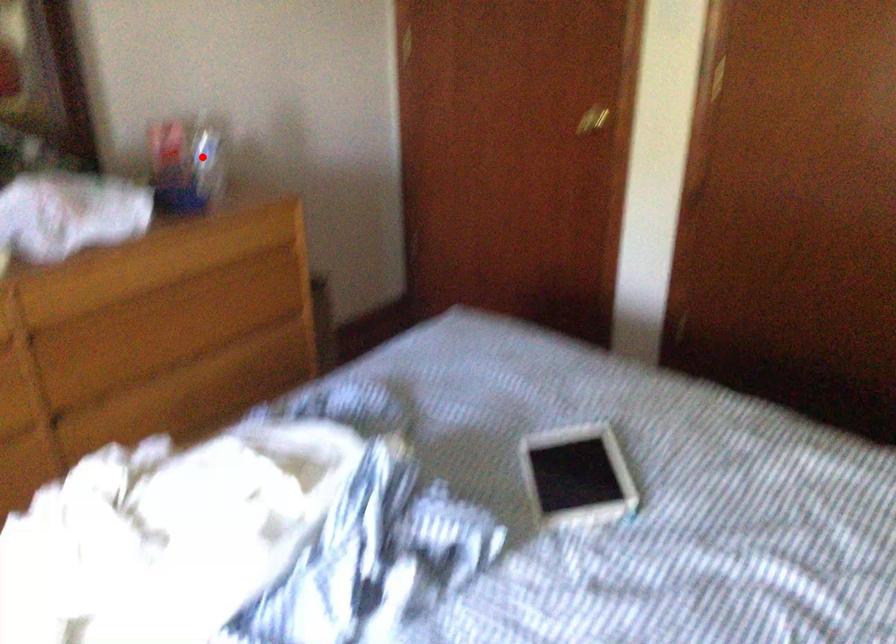
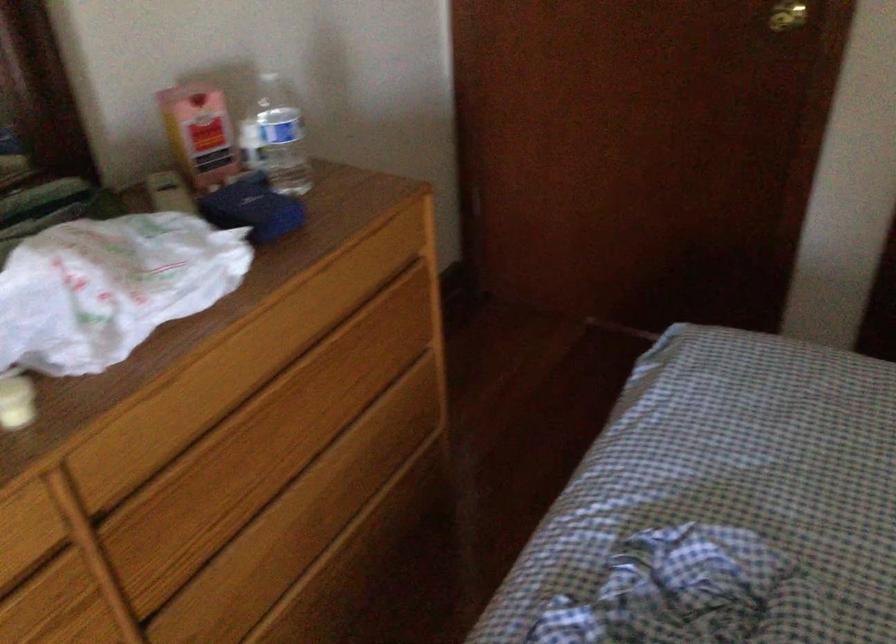
Question: A red point is marked in image1. In image2, is the corresponding 3D point closer to the camera or farther? Reply with the corresponding letter.

Choices:
 (A) The corresponding 3D point is closer.
 (B) The corresponding 3D point is farther.

Answer: (A)